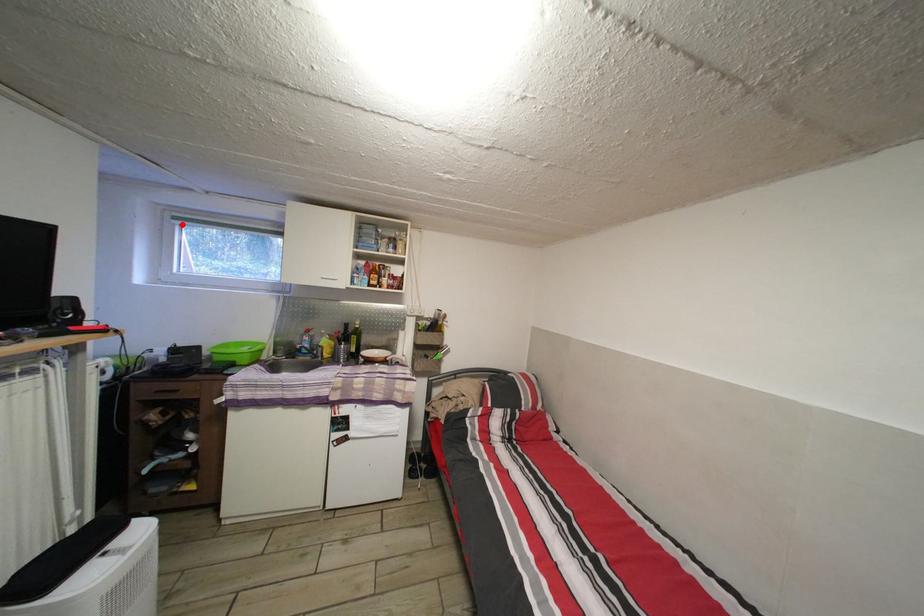
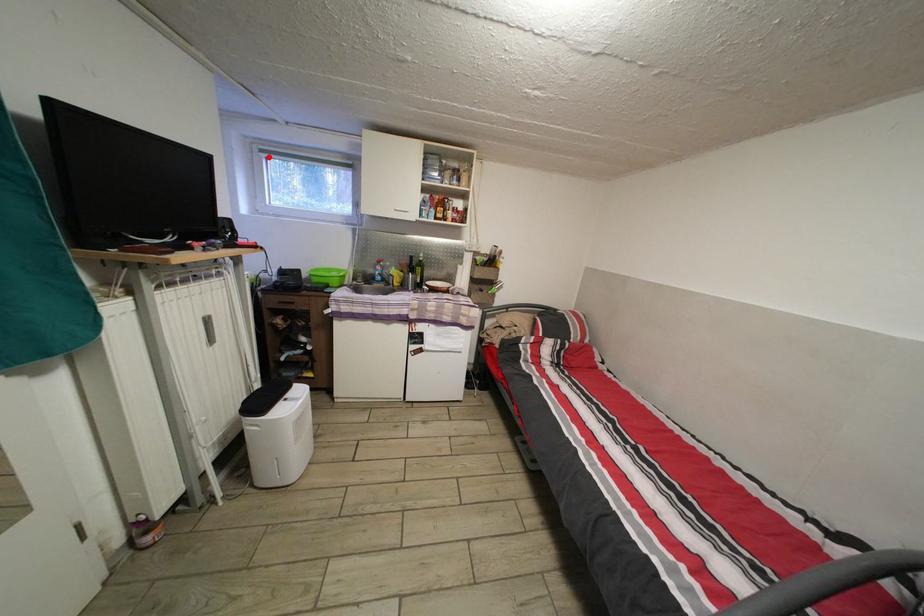
I am providing you with two images of the same scene from different viewpoints. A red point is marked on the first image and another point is marked on the second image. Are the points marked in image1 and image2 representing the same 3D position?

Yes